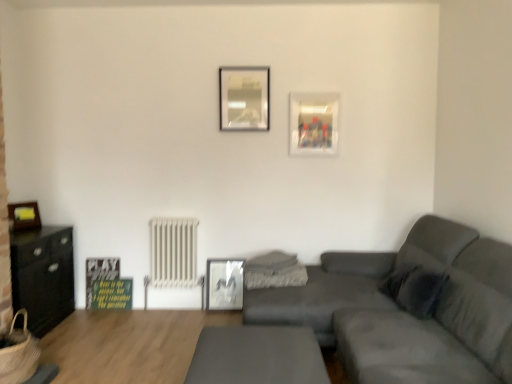
Question: Which direction should I rotate to look at metallic silver picture frame at upper center, which is the first picture frame in top-to-bottom order, — up or down?

Choices:
 (A) up
 (B) down

Answer: (A)

Question: Considering the relative sizes of matte gray couch at center and black matte cabinet at left in the image provided, is matte gray couch at center taller than black matte cabinet at left?

Choices:
 (A) no
 (B) yes

Answer: (B)

Question: Is black matte cabinet at left surrounded by matte gray couch at center?

Choices:
 (A) yes
 (B) no

Answer: (B)

Question: Is matte gray couch at center positioned in front of black matte cabinet at left?

Choices:
 (A) yes
 (B) no

Answer: (A)

Question: Can you confirm if matte gray couch at center is positioned to the left of black matte cabinet at left?

Choices:
 (A) no
 (B) yes

Answer: (A)

Question: Is matte gray couch at center far from black matte cabinet at left?

Choices:
 (A) no
 (B) yes

Answer: (B)

Question: Does matte gray couch at center appear on the right side of black matte cabinet at left?

Choices:
 (A) yes
 (B) no

Answer: (A)

Question: Is metallic silver picture frame at center, the 4th picture frame from the top, oriented away from metallic silver picture frame at upper center, which is counted as the 3th picture frame, starting from the left?

Choices:
 (A) no
 (B) yes

Answer: (A)

Question: Does metallic silver picture frame at center, the 4th picture frame from the top, have a lesser width compared to metallic silver picture frame at upper center, which is counted as the 3th picture frame, starting from the left?

Choices:
 (A) yes
 (B) no

Answer: (B)

Question: Does metallic silver picture frame at center, marked as the third picture frame in a right-to-left arrangement, appear on the right side of metallic silver picture frame at upper center, which is the fourth picture frame in bottom-to-top order?

Choices:
 (A) yes
 (B) no

Answer: (B)

Question: Is metallic silver picture frame at center, positioned as the 1th picture frame in bottom-to-top order, at the left side of metallic silver picture frame at upper center, which is the first picture frame in top-to-bottom order?

Choices:
 (A) yes
 (B) no

Answer: (A)

Question: Does metallic silver picture frame at center, which is the second picture frame from left to right, lie behind metallic silver picture frame at upper center, which is the first picture frame in top-to-bottom order?

Choices:
 (A) yes
 (B) no

Answer: (A)

Question: Would you say metallic silver picture frame at center, marked as the third picture frame in a right-to-left arrangement, contains metallic silver picture frame at upper center, which is counted as the 3th picture frame, starting from the left?

Choices:
 (A) no
 (B) yes

Answer: (A)

Question: Is white metallic radiator at center-left thinner than matte black picture frame at left, which is the first picture frame from left to right?

Choices:
 (A) no
 (B) yes

Answer: (A)